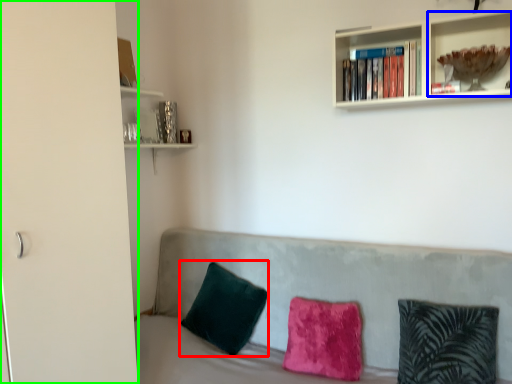
Question: Which object is positioned farthest from pillow (highlighted by a red box)? Select from shelf (highlighted by a blue box) and glass door (highlighted by a green box).

Choices:
 (A) shelf
 (B) glass door

Answer: (A)